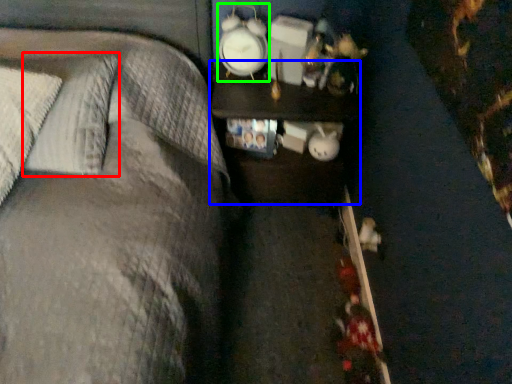
Question: Which object is the farthest from pillow (highlighted by a red box)? Choose among these: nightstand (highlighted by a blue box) or clock (highlighted by a green box).

Choices:
 (A) nightstand
 (B) clock

Answer: (B)